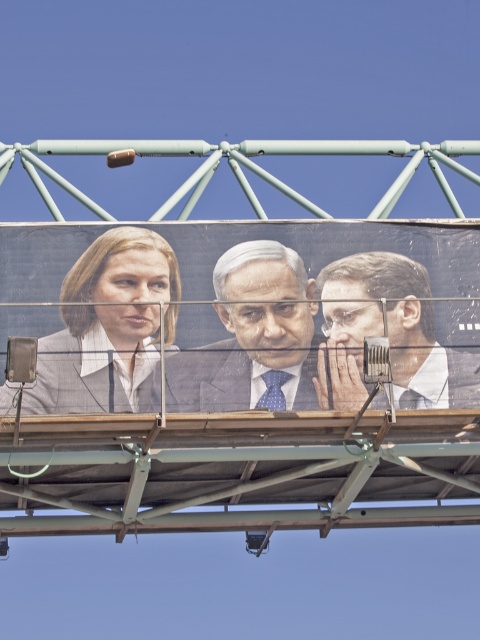
You are a graphic designer working on a billboard layout. You need to place a small logo exactly at the point with coordinates point (108, 324). According to the image, where will this logo be placed?

The point (108, 324) is on the matte gray suit at center, so the logo will be placed on the matte gray suit at center.

You are a photographer trying to capture a clear photo of the smooth gray suit at center. However, the matte plastic billboard at center is blocking your view. Can you adjust your position to avoid the billboard?

The matte plastic billboard at center is closer to the viewer than the smooth gray suit at center, so moving your position slightly to the side or adjusting your angle might allow you to see around the billboard and capture the smooth gray suit at center.